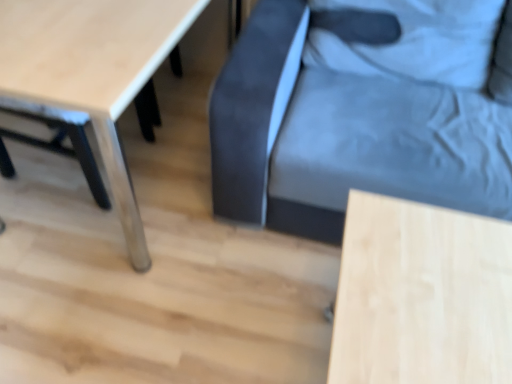
Measure the distance between dark blue fabric swivel chair at center and camera.

The depth of dark blue fabric swivel chair at center is 1.21 meters.

The image size is (512, 384). What do you see at coordinates (93, 71) in the screenshot? I see `light wood table at lower left, arranged as the second table when viewed from the right` at bounding box center [93, 71].

At what (x,y) coordinates should I click in order to perform the action: click on light wood table at lower right, the 1th table viewed from the right. Please return your answer as a coordinate pair (x, y). This screenshot has width=512, height=384. Looking at the image, I should click on (421, 295).

Between point (489, 333) and point (262, 38), which one is positioned in front?

Point (489, 333)

Is light wood table at lower right, acting as the second table starting from the left, located outside dark blue fabric swivel chair at center?

Absolutely, light wood table at lower right, acting as the second table starting from the left, is external to dark blue fabric swivel chair at center.

Is light wood table at lower right, the 1th table viewed from the right, in contact with dark blue fabric swivel chair at center?

They are not placed beside each other.

Considering the positions of objects light wood table at lower right, the 1th table viewed from the right, and light wood table at lower left, placed as the 1th table when sorted from left to right, in the image provided, who is more to the right, light wood table at lower right, the 1th table viewed from the right, or light wood table at lower left, placed as the 1th table when sorted from left to right,?

light wood table at lower right, the 1th table viewed from the right, is more to the right.

From a real-world perspective, is light wood table at lower right, acting as the second table starting from the left, over light wood table at lower left, arranged as the second table when viewed from the right?

No.

Are light wood table at lower right, the 1th table viewed from the right, and light wood table at lower left, arranged as the second table when viewed from the right, located far from each other?

light wood table at lower right, the 1th table viewed from the right, is near light wood table at lower left, arranged as the second table when viewed from the right, not far away.

From the picture: Is light wood table at lower right, acting as the second table starting from the left, positioned in front of light wood table at lower left, arranged as the second table when viewed from the right?

Yes, light wood table at lower right, acting as the second table starting from the left, is in front of light wood table at lower left, arranged as the second table when viewed from the right.

The width and height of the screenshot is (512, 384). I want to click on the 1st table below the dark blue fabric swivel chair at center (from a real-world perspective), so click(x=93, y=71).

Does light wood table at lower left, placed as the 1th table when sorted from left to right, turn towards dark blue fabric swivel chair at center?

Yes, light wood table at lower left, placed as the 1th table when sorted from left to right, is aimed at dark blue fabric swivel chair at center.

Considering the positions of objects light wood table at lower left, placed as the 1th table when sorted from left to right, and dark blue fabric swivel chair at center in the image provided, who is more to the right, light wood table at lower left, placed as the 1th table when sorted from left to right, or dark blue fabric swivel chair at center?

dark blue fabric swivel chair at center is more to the right.

Between dark blue fabric swivel chair at center and light wood table at lower right, acting as the second table starting from the left, which one is positioned in front?

light wood table at lower right, acting as the second table starting from the left, is closer to the camera.

Is dark blue fabric swivel chair at center shorter than light wood table at lower right, the 1th table viewed from the right?

In fact, dark blue fabric swivel chair at center may be taller than light wood table at lower right, the 1th table viewed from the right.

Does dark blue fabric swivel chair at center contain light wood table at lower right, the 1th table viewed from the right?

No, light wood table at lower right, the 1th table viewed from the right, is located outside of dark blue fabric swivel chair at center.

Can you confirm if dark blue fabric swivel chair at center is wider than light wood table at lower left, placed as the 1th table when sorted from left to right?

Indeed, dark blue fabric swivel chair at center has a greater width compared to light wood table at lower left, placed as the 1th table when sorted from left to right.

Between dark blue fabric swivel chair at center and light wood table at lower left, arranged as the second table when viewed from the right, which one has more height?

Standing taller between the two is dark blue fabric swivel chair at center.

Is dark blue fabric swivel chair at center turned away from light wood table at lower left, placed as the 1th table when sorted from left to right?

No, dark blue fabric swivel chair at center is not facing the opposite direction of light wood table at lower left, placed as the 1th table when sorted from left to right.

What's the angular difference between dark blue fabric swivel chair at center and light wood table at lower left, arranged as the second table when viewed from the right,'s facing directions?

88.9 degrees separate the facing orientations of dark blue fabric swivel chair at center and light wood table at lower left, arranged as the second table when viewed from the right.

Which object is thinner, light wood table at lower left, placed as the 1th table when sorted from left to right, or light wood table at lower right, acting as the second table starting from the left?

Thinner between the two is light wood table at lower right, acting as the second table starting from the left.

From the picture: In terms of size, does light wood table at lower left, arranged as the second table when viewed from the right, appear bigger or smaller than light wood table at lower right, the 1th table viewed from the right?

Considering their sizes, light wood table at lower left, arranged as the second table when viewed from the right, takes up more space than light wood table at lower right, the 1th table viewed from the right.

How many degrees apart are the facing directions of light wood table at lower left, placed as the 1th table when sorted from left to right, and light wood table at lower right, acting as the second table starting from the left?

89.3 degrees separate the facing orientations of light wood table at lower left, placed as the 1th table when sorted from left to right, and light wood table at lower right, acting as the second table starting from the left.

Is light wood table at lower left, arranged as the second table when viewed from the right, in front of light wood table at lower right, acting as the second table starting from the left?

No, light wood table at lower left, arranged as the second table when viewed from the right, is further to the viewer.

Where is `table lying below the dark blue fabric swivel chair at center (from the image's perspective)`? Image resolution: width=512 pixels, height=384 pixels. table lying below the dark blue fabric swivel chair at center (from the image's perspective) is located at coordinates (421, 295).

In the image, there is a light wood table at lower right, the 1th table viewed from the right. Where is `table above it (from the image's perspective)`? This screenshot has height=384, width=512. table above it (from the image's perspective) is located at coordinates (93, 71).

When comparing their distances from dark blue fabric swivel chair at center, does light wood table at lower left, arranged as the second table when viewed from the right, or light wood table at lower right, acting as the second table starting from the left, seem closer?

light wood table at lower right, acting as the second table starting from the left, is closer to dark blue fabric swivel chair at center.

Estimate the real-world distances between objects in this image. Which object is further from light wood table at lower right, acting as the second table starting from the left, light wood table at lower left, placed as the 1th table when sorted from left to right, or dark blue fabric swivel chair at center?

Among the two, light wood table at lower left, placed as the 1th table when sorted from left to right, is located further to light wood table at lower right, acting as the second table starting from the left.

When comparing their distances from light wood table at lower right, the 1th table viewed from the right, does dark blue fabric swivel chair at center or light wood table at lower left, arranged as the second table when viewed from the right, seem further?

The object further to light wood table at lower right, the 1th table viewed from the right, is light wood table at lower left, arranged as the second table when viewed from the right.

Looking at the image, which one is located closer to dark blue fabric swivel chair at center, light wood table at lower right, acting as the second table starting from the left, or light wood table at lower left, placed as the 1th table when sorted from left to right?

light wood table at lower right, acting as the second table starting from the left, is positioned closer to the anchor dark blue fabric swivel chair at center.

Estimate the real-world distances between objects in this image. Which object is closer to light wood table at lower left, arranged as the second table when viewed from the right, dark blue fabric swivel chair at center or light wood table at lower right, acting as the second table starting from the left?

dark blue fabric swivel chair at center lies closer to light wood table at lower left, arranged as the second table when viewed from the right, than the other object.

When comparing their distances from light wood table at lower left, placed as the 1th table when sorted from left to right, does light wood table at lower right, the 1th table viewed from the right, or dark blue fabric swivel chair at center seem further?

light wood table at lower right, the 1th table viewed from the right, lies further to light wood table at lower left, placed as the 1th table when sorted from left to right, than the other object.

The image size is (512, 384). In order to click on table between light wood table at lower left, placed as the 1th table when sorted from left to right, and dark blue fabric swivel chair at center in this screenshot , I will do tap(421, 295).